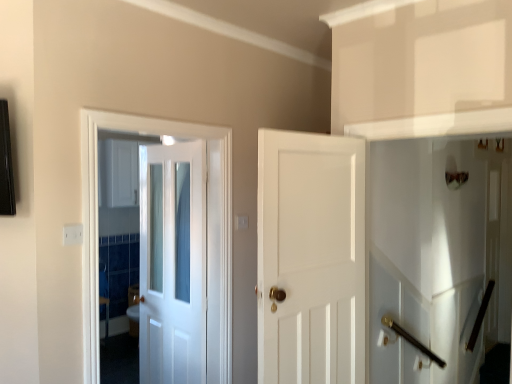
Question: Is white glossy door at center, the second door in the left-to-right sequence, aimed at white glossy door at center, placed as the 3th door when sorted from left to right?

Choices:
 (A) no
 (B) yes

Answer: (A)

Question: Can you confirm if white glossy door at center, the second door positioned from the right, is shorter than white glossy door at center, placed as the 3th door when sorted from left to right?

Choices:
 (A) no
 (B) yes

Answer: (A)

Question: Considering the relative sizes of white glossy door at center, the second door positioned from the right, and white glossy door at center, placed as the 3th door when sorted from left to right, in the image provided, is white glossy door at center, the second door positioned from the right, taller than white glossy door at center, placed as the 3th door when sorted from left to right,?

Choices:
 (A) yes
 (B) no

Answer: (A)

Question: From the image's perspective, is white glossy door at center, the second door positioned from the right, below white glossy door at center, placed as the 3th door when sorted from left to right?

Choices:
 (A) yes
 (B) no

Answer: (A)

Question: Can you confirm if white glossy door at center, the second door in the left-to-right sequence, is bigger than white glossy door at center, the 1th door when ordered from right to left?

Choices:
 (A) no
 (B) yes

Answer: (A)

Question: Is white glossy door at center, the second door positioned from the right, outside of white glossy door at center, placed as the 3th door when sorted from left to right?

Choices:
 (A) no
 (B) yes

Answer: (B)

Question: From the image's perspective, is polished brass door handle at lower right on white glossy elevator at right?

Choices:
 (A) yes
 (B) no

Answer: (B)

Question: Could you tell me if polished brass door handle at lower right is turned towards white glossy elevator at right?

Choices:
 (A) no
 (B) yes

Answer: (A)

Question: Is polished brass door handle at lower right facing away from white glossy elevator at right?

Choices:
 (A) no
 (B) yes

Answer: (A)

Question: Would you say polished brass door handle at lower right is outside white glossy elevator at right?

Choices:
 (A) no
 (B) yes

Answer: (B)

Question: Is polished brass door handle at lower right far from white glossy elevator at right?

Choices:
 (A) no
 (B) yes

Answer: (B)

Question: Does polished brass door handle at lower right have a smaller size compared to white glossy elevator at right?

Choices:
 (A) yes
 (B) no

Answer: (B)

Question: Is white glossy door at center, the second door positioned from the right, positioned beyond the bounds of polished brass door handle at lower right?

Choices:
 (A) yes
 (B) no

Answer: (A)